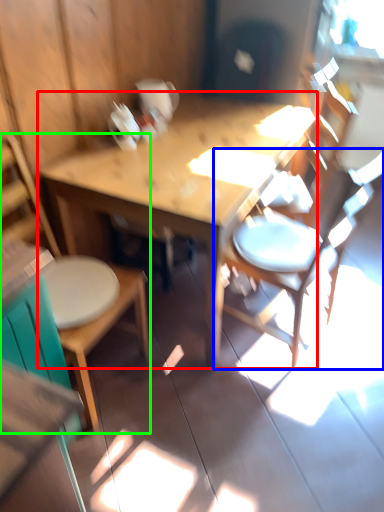
Question: Based on their relative distances, which object is farther from table (highlighted by a red box)? Choose from chair (highlighted by a blue box) and chair (highlighted by a green box).

Choices:
 (A) chair
 (B) chair

Answer: (B)